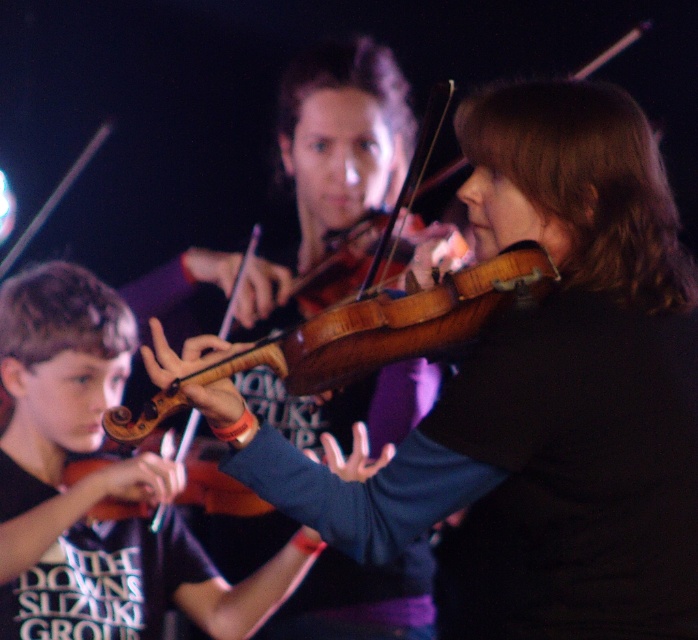
You are a photographer standing at the back of the stage. You want to take a photo that clearly shows both the wooden violin at center and the matte brown violin at lower left. Which violin will appear larger in your photo?

The wooden violin at center will appear larger in the photo because it is closer to the viewer than the matte brown violin at lower left.

In the image of the violinists, there is a wooden violin at center. What is the position of the wooden violin at center relative to the point marked at coordinates (542, 396)?

The point marked at coordinates (542, 396) indicates the position of the wooden violin at center.

In the scene shown: You are a stagehand who needs to move a 24 inch wide equipment cart between the wooden violin at center and the matte brown violin at lower left. Can the cart pass through the space between them?

The distance between the wooden violin at center and the matte brown violin at lower left is 24.63 inches, which is slightly wider than the 24 inch cart. Therefore, the cart can pass through the space between them.